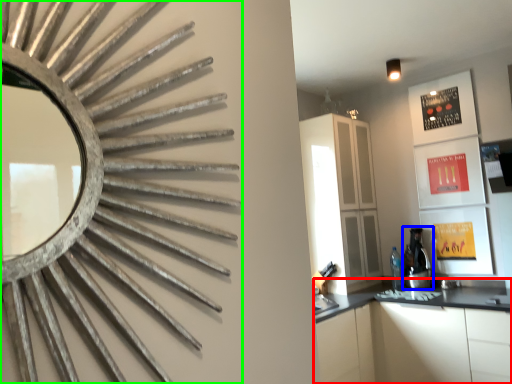
Question: Which object is positioned farthest from cabinetry (highlighted by a red box)? Select from coffee machine (highlighted by a blue box) and mirror (highlighted by a green box).

Choices:
 (A) coffee machine
 (B) mirror

Answer: (B)